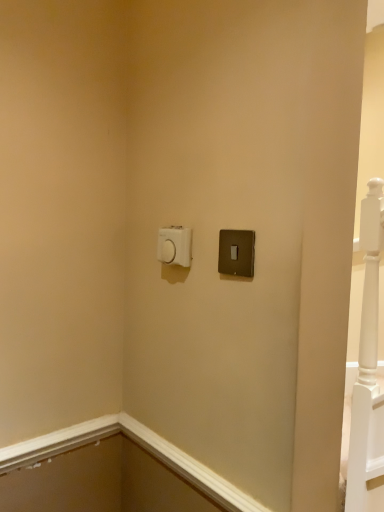
Question: Which direction should I rotate to look at white plastic light switch at upper center, the 2th light switch positioned from the front?

Choices:
 (A) left
 (B) right

Answer: (A)

Question: From a real-world perspective, does white plastic light switch at upper center, which appears as the second light switch when viewed from the right, stand above satin black switch at upper right, which ranks as the 1th light switch in right-to-left order?

Choices:
 (A) yes
 (B) no

Answer: (A)

Question: Is white plastic light switch at upper center, the 2th light switch positioned from the front, turned away from satin black switch at upper right, placed as the 2th light switch when sorted from back to front?

Choices:
 (A) yes
 (B) no

Answer: (B)

Question: Is white plastic light switch at upper center, the 2th light switch positioned from the front, further to camera compared to satin black switch at upper right, which is the 2th light switch from left to right?

Choices:
 (A) yes
 (B) no

Answer: (A)

Question: Is white plastic light switch at upper center, the 2th light switch positioned from the front, thinner than satin black switch at upper right, the 1th light switch from the front?

Choices:
 (A) yes
 (B) no

Answer: (B)

Question: Considering the relative positions of white plastic light switch at upper center, the 2th light switch positioned from the front, and satin black switch at upper right, which ranks as the 1th light switch in right-to-left order, in the image provided, is white plastic light switch at upper center, the 2th light switch positioned from the front, in front of satin black switch at upper right, which ranks as the 1th light switch in right-to-left order,?

Choices:
 (A) no
 (B) yes

Answer: (A)

Question: Could you tell me if white plastic light switch at upper center, the 2th light switch positioned from the front, is turned towards satin black switch at upper right, which ranks as the 1th light switch in right-to-left order?

Choices:
 (A) no
 (B) yes

Answer: (A)

Question: Can you confirm if satin black switch at upper right, placed as the 2th light switch when sorted from back to front, is taller than white plastic light switch at upper center, the first light switch in the back-to-front sequence?

Choices:
 (A) no
 (B) yes

Answer: (B)

Question: Is white plastic light switch at upper center, the first light switch in the back-to-front sequence, located within satin black switch at upper right, placed as the 2th light switch when sorted from back to front?

Choices:
 (A) yes
 (B) no

Answer: (B)

Question: Is satin black switch at upper right, which ranks as the 1th light switch in right-to-left order, far away from white plastic light switch at upper center, the first light switch in the back-to-front sequence?

Choices:
 (A) no
 (B) yes

Answer: (A)

Question: From the image's perspective, is satin black switch at upper right, which ranks as the 1th light switch in right-to-left order, below white plastic light switch at upper center, the first light switch in the back-to-front sequence?

Choices:
 (A) yes
 (B) no

Answer: (A)

Question: From the image's perspective, is satin black switch at upper right, which ranks as the 1th light switch in right-to-left order, on white plastic light switch at upper center, the first light switch in the back-to-front sequence?

Choices:
 (A) no
 (B) yes

Answer: (A)

Question: Does satin black switch at upper right, which ranks as the 1th light switch in right-to-left order, have a smaller size compared to white plastic light switch at upper center, marked as the first light switch in a left-to-right arrangement?

Choices:
 (A) no
 (B) yes

Answer: (B)

Question: Based on their sizes in the image, would you say satin black switch at upper right, which is the 2th light switch from left to right, is bigger or smaller than white plastic light switch at upper center, marked as the first light switch in a left-to-right arrangement?

Choices:
 (A) small
 (B) big

Answer: (A)